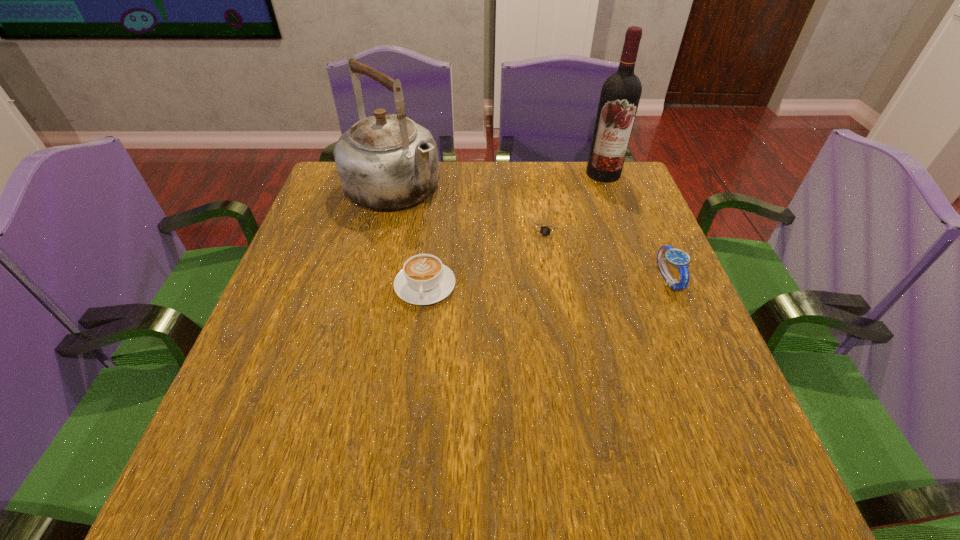
In order to click on vacant space on the desktop that is between the cappuccino and the taller watch and is positioned on the label of the wine bottle in this screenshot , I will do 540,282.

In order to click on vacant space on the desktop that is between the second shortest object and the nearer watch and is positioned on the face of the shorter watch in this screenshot , I will do `click(516, 283)`.

The height and width of the screenshot is (540, 960). I want to click on vacant space on the desktop that is between the second shortest object and the right watch and is positioned at the spout of the kettle, so click(516, 284).